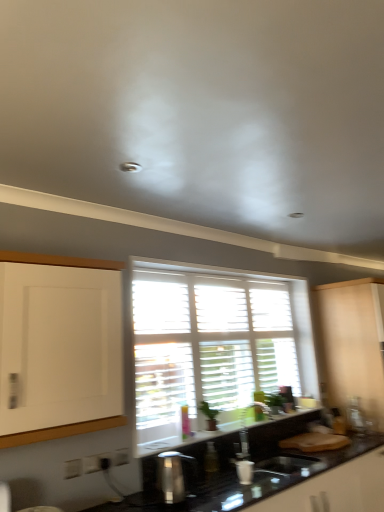
Describe the element at coordinates (172, 475) in the screenshot. This screenshot has width=384, height=512. I see `metallic silver soap dispenser at lower center, the first appliance positioned from the front` at that location.

Measure the distance between white wooden blinds at center and camera.

white wooden blinds at center and camera are 2.49 meters apart from each other.

Locate an element on the screen. This screenshot has width=384, height=512. metallic silver soap dispenser at lower center, which is the 2th appliance in right-to-left order is located at coordinates (172, 475).

From a real-world perspective, is metallic silver toaster at right, which is the 1th appliance in right-to-left order, physically above black glossy countertop at lower center?

Yes, from a real-world perspective, metallic silver toaster at right, which is the 1th appliance in right-to-left order, is on top of black glossy countertop at lower center.

Between point (358, 407) and point (280, 479), which one is positioned in front?

Positioned in front is point (280, 479).

Is the surface of metallic silver toaster at right, which is counted as the 1th appliance, starting from the back, in direct contact with black glossy countertop at lower center?

No, metallic silver toaster at right, which is counted as the 1th appliance, starting from the back, is not making contact with black glossy countertop at lower center.

Is metallic silver toaster at right, which is the 1th appliance in right-to-left order, inside the boundaries of black glossy countertop at lower center, or outside?

metallic silver toaster at right, which is the 1th appliance in right-to-left order, is located beyond the bounds of black glossy countertop at lower center.

Does point (166, 495) come farther from viewer compared to point (363, 419)?

No.

Consider the image. Is metallic silver soap dispenser at lower center, the first appliance positioned from the front, far away from metallic silver toaster at right, the second appliance in the front-to-back sequence?

metallic silver soap dispenser at lower center, the first appliance positioned from the front, is far away from metallic silver toaster at right, the second appliance in the front-to-back sequence.

Is metallic silver soap dispenser at lower center, the first appliance positioned from the front, positioned with its back to metallic silver toaster at right, the second appliance in the front-to-back sequence?

No, metallic silver soap dispenser at lower center, the first appliance positioned from the front, is not facing away from metallic silver toaster at right, the second appliance in the front-to-back sequence.

Does point (170, 474) come closer to viewer compared to point (316, 306)?

Yes, it is.

Is metallic silver soap dispenser at lower center, marked as the first appliance in a left-to-right arrangement, further to camera compared to beige matte cabinet at right?

No, metallic silver soap dispenser at lower center, marked as the first appliance in a left-to-right arrangement, is closer to the camera.

Is metallic silver soap dispenser at lower center, marked as the first appliance in a left-to-right arrangement, with beige matte cabinet at right?

No, metallic silver soap dispenser at lower center, marked as the first appliance in a left-to-right arrangement, is not in contact with beige matte cabinet at right.

Is beige matte cabinet at right completely or partially inside metallic silver soap dispenser at lower center, the second appliance positioned from the back?

That's incorrect, beige matte cabinet at right is not inside metallic silver soap dispenser at lower center, the second appliance positioned from the back.

Choose the correct answer: Is metallic silver soap dispenser at lower center, which is the 2th appliance in right-to-left order, inside white wooden blinds at center or outside it?

metallic silver soap dispenser at lower center, which is the 2th appliance in right-to-left order, is not enclosed by white wooden blinds at center.

At what (x,y) coordinates should I click in order to perform the action: click on window behind the metallic silver soap dispenser at lower center, the second appliance positioned from the back. Please return your answer as a coordinate pair (x, y). Looking at the image, I should click on (214, 345).

Would you consider metallic silver soap dispenser at lower center, the first appliance positioned from the front, to be distant from white wooden blinds at center?

Actually, metallic silver soap dispenser at lower center, the first appliance positioned from the front, and white wooden blinds at center are a little close together.

Consider the image. From the image's perspective, does black glossy countertop at lower center appear lower than metallic silver soap dispenser at lower center, marked as the first appliance in a left-to-right arrangement?

Indeed, from the image's perspective, black glossy countertop at lower center is shown beneath metallic silver soap dispenser at lower center, marked as the first appliance in a left-to-right arrangement.

Can you confirm if black glossy countertop at lower center is wider than metallic silver soap dispenser at lower center, marked as the first appliance in a left-to-right arrangement?

Correct, the width of black glossy countertop at lower center exceeds that of metallic silver soap dispenser at lower center, marked as the first appliance in a left-to-right arrangement.

Identify the location of appliance on the left of black glossy countertop at lower center. This screenshot has width=384, height=512. (172, 475).

Between point (232, 474) and point (165, 480), which one is positioned behind?

The point (232, 474) is behind.

Is white wooden blinds at center located outside metallic silver toaster at right, which is counted as the 1th appliance, starting from the back?

Yes, white wooden blinds at center is located beyond the bounds of metallic silver toaster at right, which is counted as the 1th appliance, starting from the back.

Does white wooden blinds at center have a smaller size compared to metallic silver toaster at right, which is counted as the 1th appliance, starting from the back?

No, white wooden blinds at center is not smaller than metallic silver toaster at right, which is counted as the 1th appliance, starting from the back.

Considering the relative sizes of white wooden blinds at center and metallic silver toaster at right, which is counted as the 1th appliance, starting from the back, in the image provided, is white wooden blinds at center taller than metallic silver toaster at right, which is counted as the 1th appliance, starting from the back,?

Indeed, white wooden blinds at center has a greater height compared to metallic silver toaster at right, which is counted as the 1th appliance, starting from the back.

At what (x,y) coordinates should I click in order to perform the action: click on window that appears on the left of metallic silver toaster at right, the second appliance in the front-to-back sequence. Please return your answer as a coordinate pair (x, y). This screenshot has height=512, width=384. Looking at the image, I should click on (214, 345).

Is black glossy countertop at lower center facing towards metallic silver toaster at right, which is counted as the 1th appliance, starting from the back?

No, black glossy countertop at lower center is not aimed at metallic silver toaster at right, which is counted as the 1th appliance, starting from the back.

In the image, is black glossy countertop at lower center on the left side or the right side of metallic silver toaster at right, which is counted as the 1th appliance, starting from the back?

From the image, it's evident that black glossy countertop at lower center is to the left of metallic silver toaster at right, which is counted as the 1th appliance, starting from the back.

Based on the photo, is black glossy countertop at lower center placed right next to metallic silver toaster at right, the second appliance from the left?

They are not placed beside each other.

Is point (291, 469) closer or farther from the camera than point (359, 423)?

Point (291, 469) appears to be closer to the viewer than point (359, 423).

I want to click on the 2nd appliance behind the black glossy countertop at lower center, so click(x=356, y=415).

Identify the location of appliance above the metallic silver soap dispenser at lower center, the first appliance positioned from the front (from a real-world perspective). (356, 415).

From the picture: Considering their positions, is metallic silver toaster at right, which is the 1th appliance in right-to-left order, positioned closer to white wooden blinds at center than black glossy countertop at lower center?

black glossy countertop at lower center.

Looking at the image, which one is located further to beige matte cabinet at right, black glossy countertop at lower center or metallic silver soap dispenser at lower center, which is the 2th appliance in right-to-left order?

metallic silver soap dispenser at lower center, which is the 2th appliance in right-to-left order, is further to beige matte cabinet at right.

Based on their spatial positions, is metallic silver toaster at right, the second appliance from the left, or white wooden blinds at center further from metallic silver soap dispenser at lower center, the first appliance positioned from the front?

Among the two, metallic silver toaster at right, the second appliance from the left, is located further to metallic silver soap dispenser at lower center, the first appliance positioned from the front.

Estimate the real-world distances between objects in this image. Which object is closer to white wooden blinds at center, beige matte cabinet at right or metallic silver soap dispenser at lower center, marked as the first appliance in a left-to-right arrangement?

Based on the image, beige matte cabinet at right appears to be nearer to white wooden blinds at center.

From the image, which object appears to be farther from white wooden blinds at center, metallic silver soap dispenser at lower center, marked as the first appliance in a left-to-right arrangement, or black glossy countertop at lower center?

metallic silver soap dispenser at lower center, marked as the first appliance in a left-to-right arrangement.

Looking at the image, which one is located further to beige matte cabinet at right, black glossy countertop at lower center or metallic silver toaster at right, which is counted as the 1th appliance, starting from the back?

black glossy countertop at lower center.

When comparing their distances from beige matte cabinet at right, does white wooden blinds at center or black glossy countertop at lower center seem closer?

white wooden blinds at center is closer to beige matte cabinet at right.

Considering their positions, is white wooden blinds at center positioned further to beige matte cabinet at right than metallic silver soap dispenser at lower center, marked as the first appliance in a left-to-right arrangement?

The object further to beige matte cabinet at right is metallic silver soap dispenser at lower center, marked as the first appliance in a left-to-right arrangement.

Find the location of a particular element. This screenshot has width=384, height=512. cabinetry located between black glossy countertop at lower center and metallic silver toaster at right, the second appliance from the left, in the depth direction is located at coordinates (352, 343).

Find the location of a particular element. window located between metallic silver soap dispenser at lower center, marked as the first appliance in a left-to-right arrangement, and metallic silver toaster at right, which is the 1th appliance in right-to-left order, in the left-right direction is located at coordinates (x=214, y=345).

This screenshot has height=512, width=384. In order to click on appliance located between white wooden blinds at center and beige matte cabinet at right in the left-right direction in this screenshot , I will do `click(356, 415)`.

Locate an element on the screen. window situated between metallic silver soap dispenser at lower center, the second appliance positioned from the back, and beige matte cabinet at right from left to right is located at coordinates (214, 345).